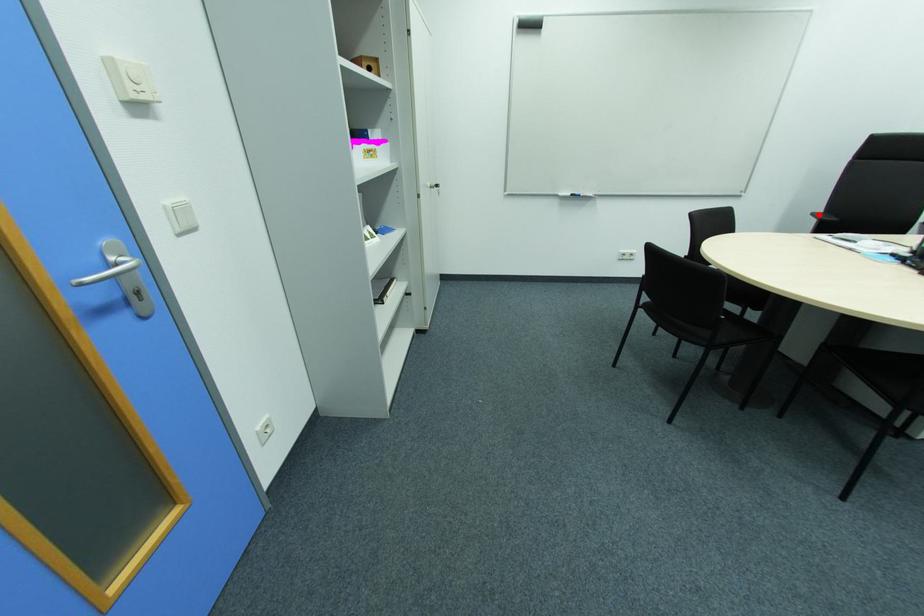
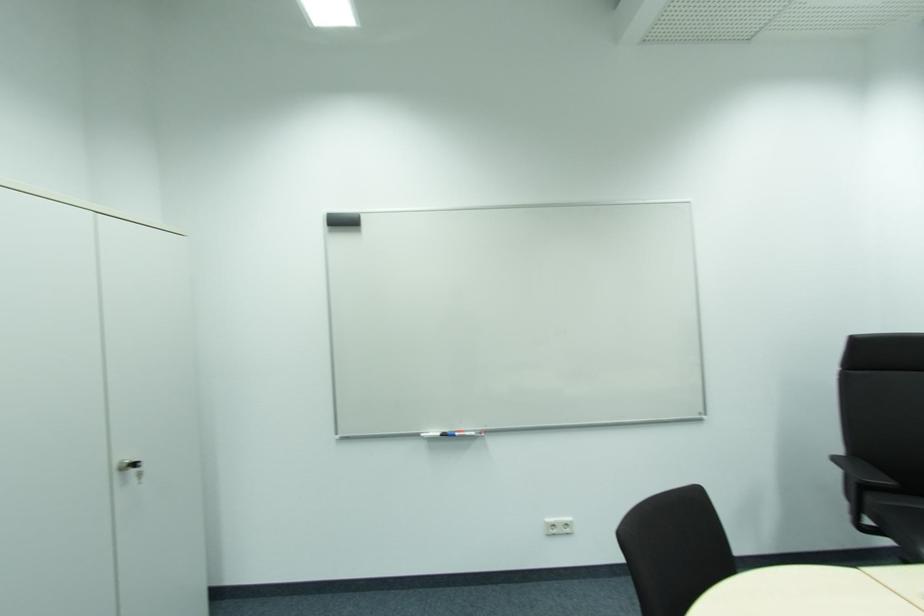
Find the pixel in the second image that matches the highlighted location in the first image.

(842, 459)